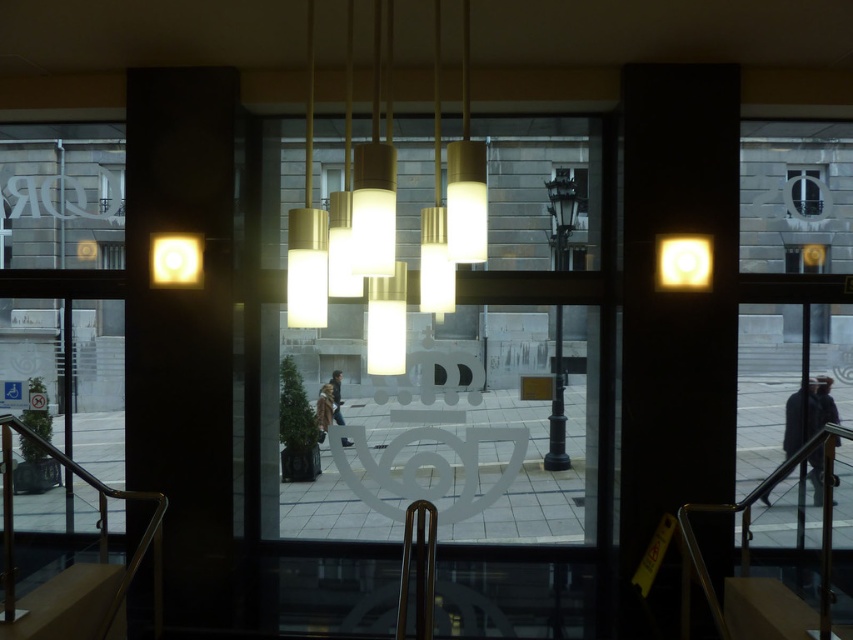
Is matte gold chandelier at center further to the viewer compared to matte white light at upper right?

No, matte gold chandelier at center is in front of matte white light at upper right.

Can you confirm if matte gold chandelier at center is wider than matte white light at upper right?

Yes, matte gold chandelier at center is wider than matte white light at upper right.

Who is more distant from viewer, (444, 209) or (676, 269)?

The point (676, 269) is behind.

At what (x,y) coordinates should I click in order to perform the action: click on matte gold chandelier at center. Please return your answer as a coordinate pair (x, y). The width and height of the screenshot is (853, 640). Looking at the image, I should click on (453, 198).

Can you confirm if matte white light at upper right is positioned to the right of matte yellow light at upper left?

Correct, you'll find matte white light at upper right to the right of matte yellow light at upper left.

Is point (666, 269) less distant than point (199, 244)?

Yes, it is in front of point (199, 244).

Between point (675, 276) and point (155, 269), which one is positioned in front?

Point (675, 276)

Find the location of a particular element. The height and width of the screenshot is (640, 853). matte white light at upper right is located at coordinates (683, 262).

Can you confirm if translucent glass window at center is wider than matte gold chandelier at center?

Indeed, translucent glass window at center has a greater width compared to matte gold chandelier at center.

Is point (451, 477) closer to camera compared to point (375, 364)?

That is False.

Image resolution: width=853 pixels, height=640 pixels. I want to click on translucent glass window at center, so click(x=462, y=369).